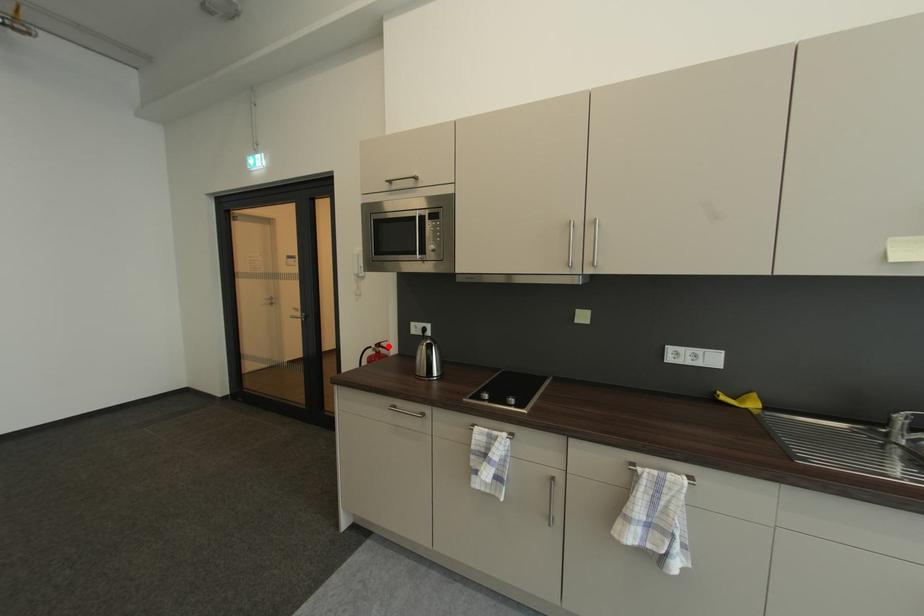
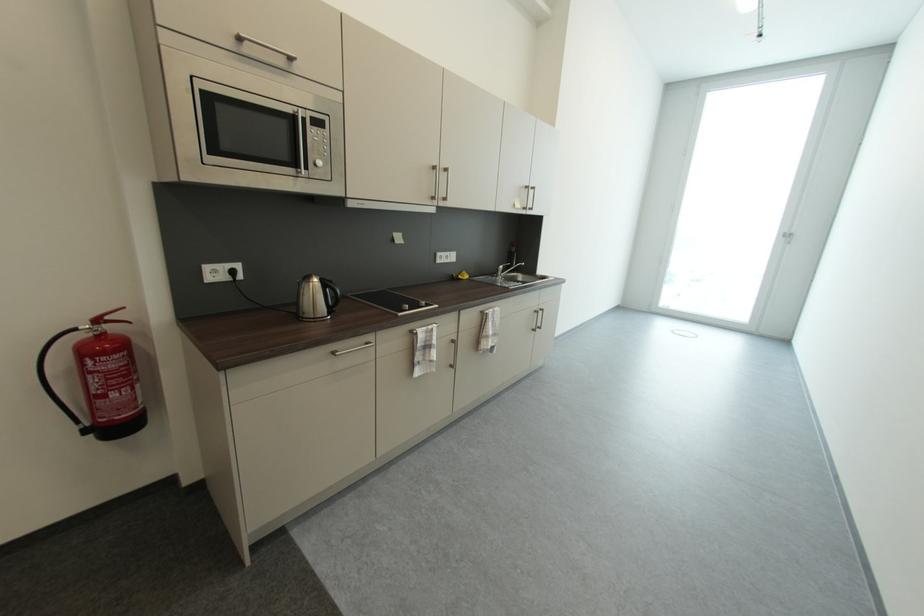
Where in the second image is the point corresponding to the highlighted location from the first image?

(116, 318)